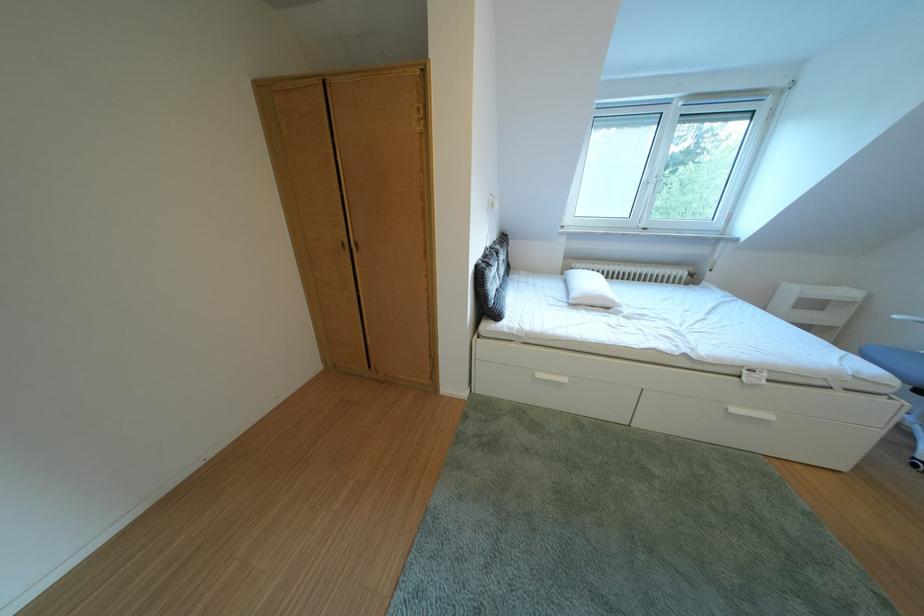
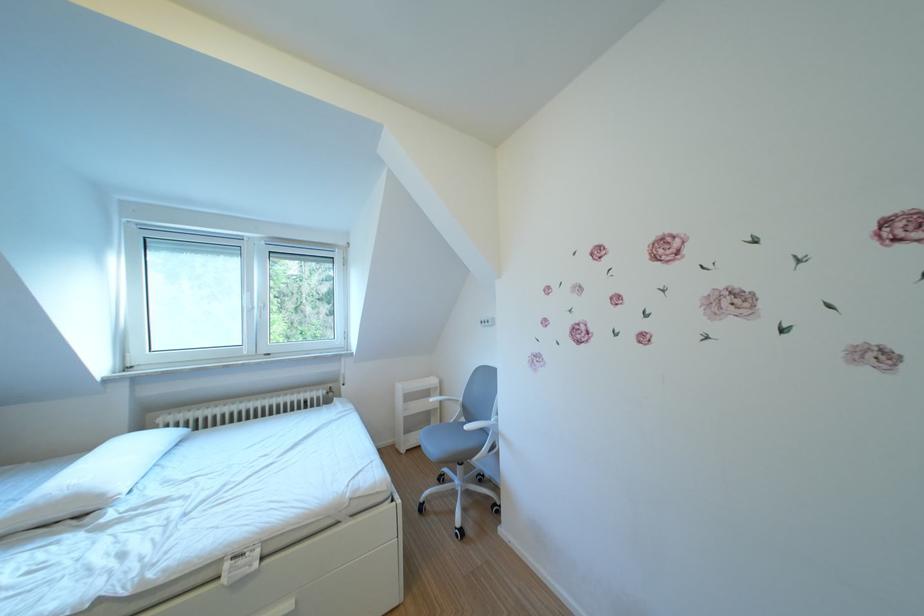
Where in the second image is the point corresponding to pixel 626 306 from the first image?

(115, 501)